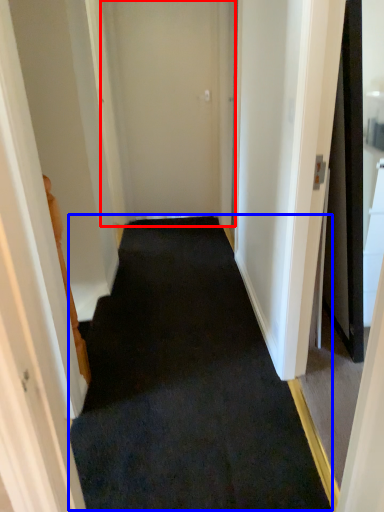
Question: Among these objects, which one is nearest to the camera, door (highlighted by a red box) or doormat (highlighted by a blue box)?

Choices:
 (A) door
 (B) doormat

Answer: (B)